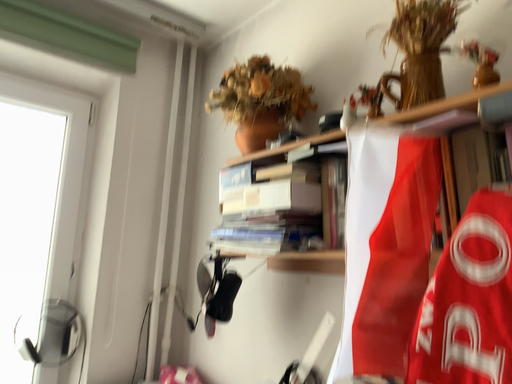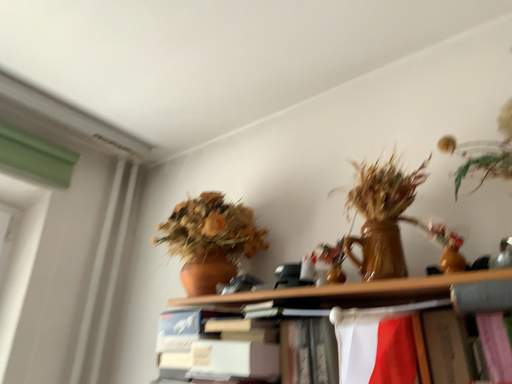
Question: Which way did the camera rotate in the video?

Choices:
 (A) rotated right
 (B) rotated left

Answer: (A)